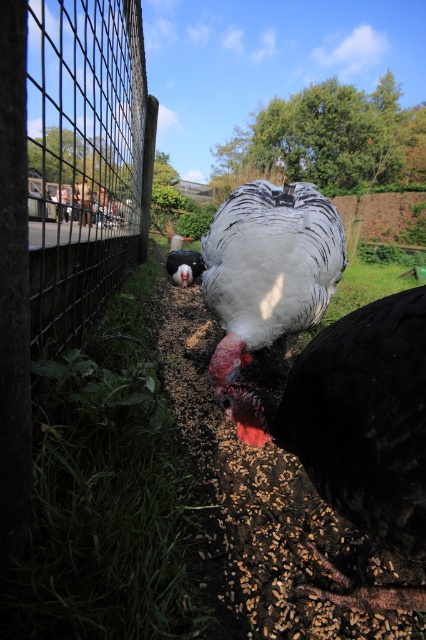
Can you confirm if white feathered turkey at center is positioned to the left of shiny black bird at center?

Incorrect, white feathered turkey at center is not on the left side of shiny black bird at center.

Can you confirm if white feathered turkey at center is shorter than shiny black bird at center?

No.

The height and width of the screenshot is (640, 426). What do you see at coordinates (268, 268) in the screenshot? I see `white feathered turkey at center` at bounding box center [268, 268].

This screenshot has width=426, height=640. What are the coordinates of `white feathered turkey at center` in the screenshot? It's located at (268, 268).

Between point (400, 490) and point (190, 276), which one is positioned in front?

Point (400, 490) is more forward.

Identify the location of white glossy turkey at center. This screenshot has height=640, width=426. (356, 417).

Where is `white glossy turkey at center`? white glossy turkey at center is located at coordinates (356, 417).

Can you confirm if white glossy turkey at center is positioned above white feathered turkey at center?

No.

Does white glossy turkey at center have a lesser height compared to white feathered turkey at center?

Yes, white glossy turkey at center is shorter than white feathered turkey at center.

Who is more forward, (405, 384) or (276, 298)?

Positioned in front is point (405, 384).

This screenshot has width=426, height=640. I want to click on white glossy turkey at center, so click(356, 417).